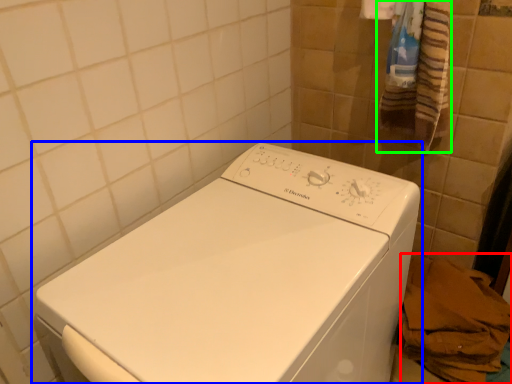
Question: Considering the real-world distances, which object is closest to material (highlighted by a red box)? washing machine (highlighted by a blue box) or bath towel (highlighted by a green box).

Choices:
 (A) washing machine
 (B) bath towel

Answer: (A)